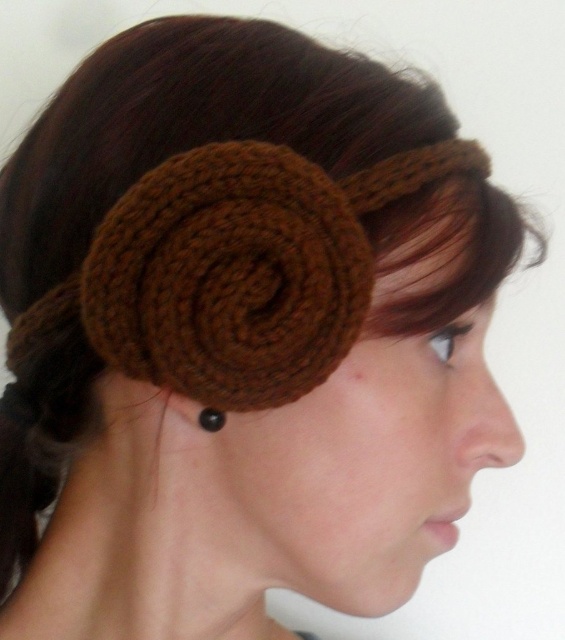
Can you confirm if brown knitted hair accessory at center is shorter than black pearl earring at ear?

In fact, brown knitted hair accessory at center may be taller than black pearl earring at ear.

Which is above, brown knitted hair accessory at center or black pearl earring at ear?

brown knitted hair accessory at center is higher up.

Locate an element on the screen. The image size is (565, 640). brown knitted hair accessory at center is located at coordinates (244, 268).